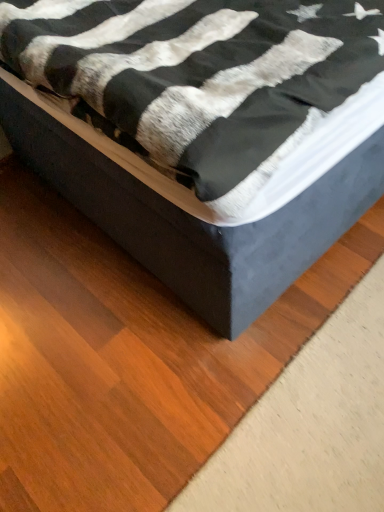
Image resolution: width=384 pixels, height=512 pixels. What are the coordinates of `velvet dark blue bed at center` in the screenshot? It's located at (204, 132).

This screenshot has height=512, width=384. What do you see at coordinates (204, 132) in the screenshot?
I see `velvet dark blue bed at center` at bounding box center [204, 132].

You are a GUI agent. You are given a task and a screenshot of the screen. Output one action in this format:
    pyautogui.click(x=<x>, y=<y>)
    Task: Click on the velvet dark blue bed at center
    
    Given the screenshot: What is the action you would take?
    pyautogui.click(x=204, y=132)